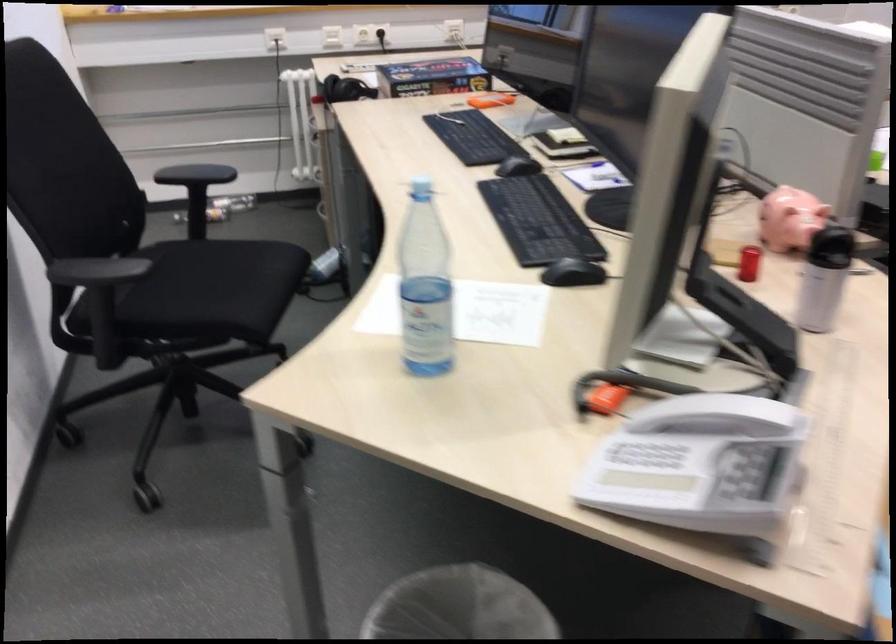
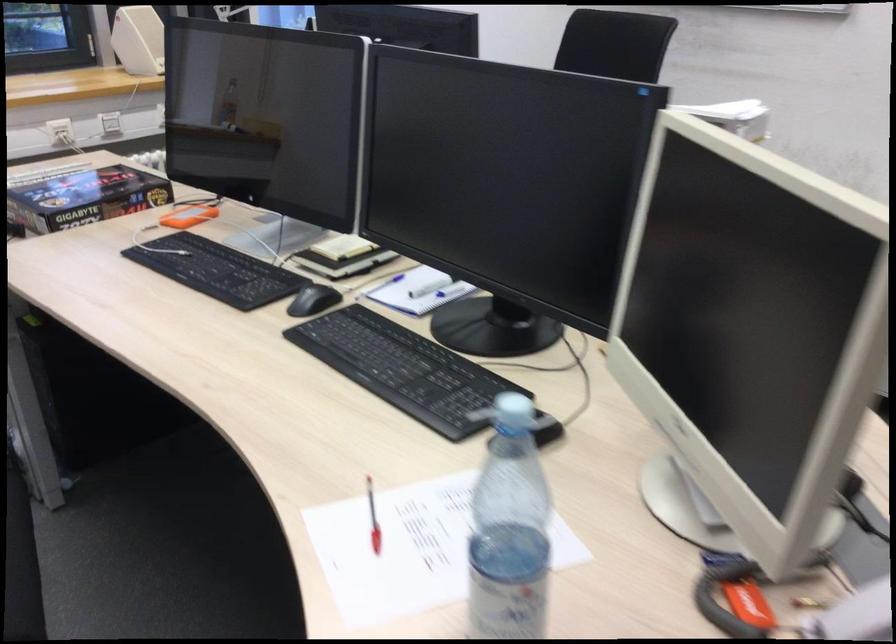
Locate, in the second image, the point that corresponds to point 510,163 in the first image.

(313, 299)